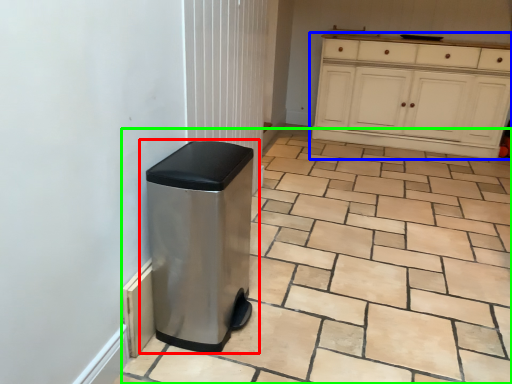
Question: Estimate the real-world distances between objects in this image. Which object is farther from waste container (highlighted by a red box), cabinetry (highlighted by a blue box) or ceramic tile (highlighted by a green box)?

Choices:
 (A) cabinetry
 (B) ceramic tile

Answer: (A)